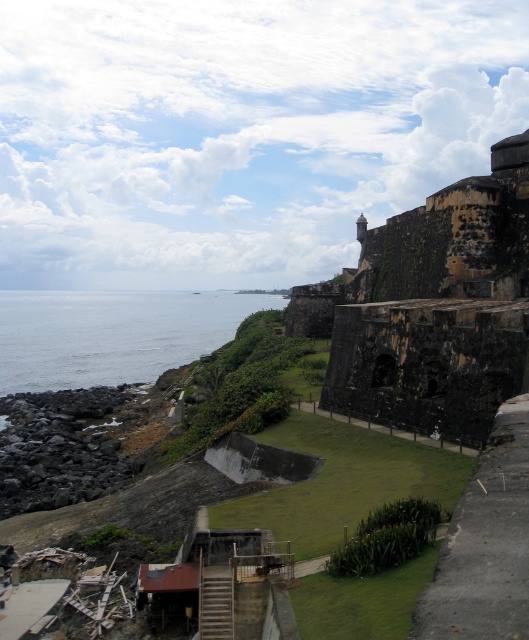
Who is shorter, dark brown stone wall at upper right or blue water at lower left?

With less height is dark brown stone wall at upper right.

Does dark brown stone wall at upper right lie in front of blue water at lower left?

Yes.

The width and height of the screenshot is (529, 640). I want to click on dark brown stone wall at upper right, so click(432, 307).

Locate an element on the screen. This screenshot has height=640, width=529. dark brown stone wall at upper right is located at coordinates (432, 307).